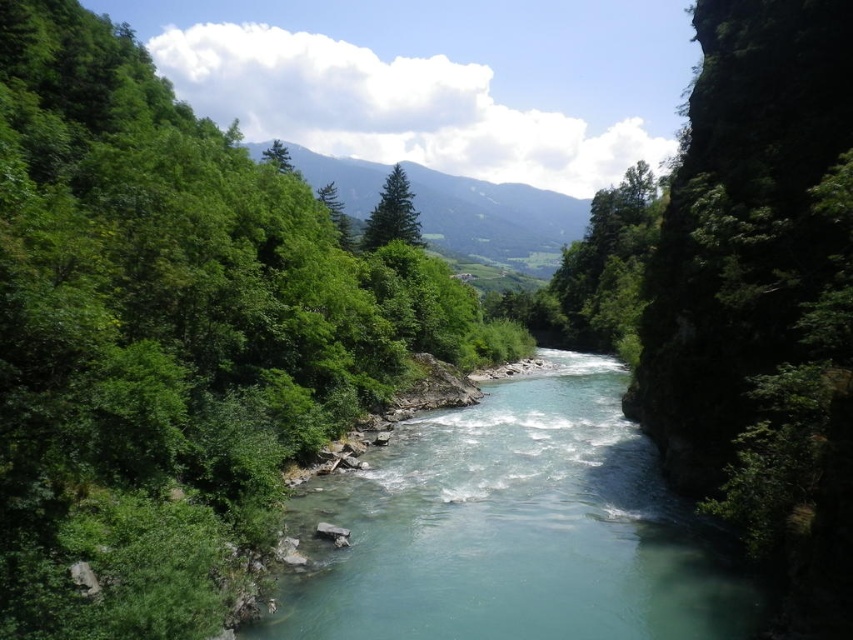
Between green leafy tree at center left and clear water at center, which one appears on the right side from the viewer's perspective?

Positioned to the right is clear water at center.

Who is shorter, green leafy tree at center left or clear water at center?

With less height is clear water at center.

You are a GUI agent. You are given a task and a screenshot of the screen. Output one action in this format:
    pyautogui.click(x=<x>, y=<y>)
    Task: Click on the green leafy tree at center left
    The width and height of the screenshot is (853, 640).
    Given the screenshot: What is the action you would take?
    pyautogui.click(x=167, y=337)

Where is `green leafy tree at center left`? green leafy tree at center left is located at coordinates (167, 337).

Does point (421, 592) come behind point (567, 234)?

No, it is not.

Locate an element on the screen. This screenshot has width=853, height=640. clear water at center is located at coordinates (512, 529).

Can you confirm if green forested mountain at center is thinner than green matte tree at upper center?

Incorrect, green forested mountain at center's width is not less than green matte tree at upper center's.

Who is positioned more to the right, green forested mountain at center or green matte tree at upper center?

From the viewer's perspective, green forested mountain at center appears more on the right side.

Who is more distant from viewer, (440, 209) or (273, 150)?

The point (440, 209) is more distant.

I want to click on green forested mountain at center, so click(495, 218).